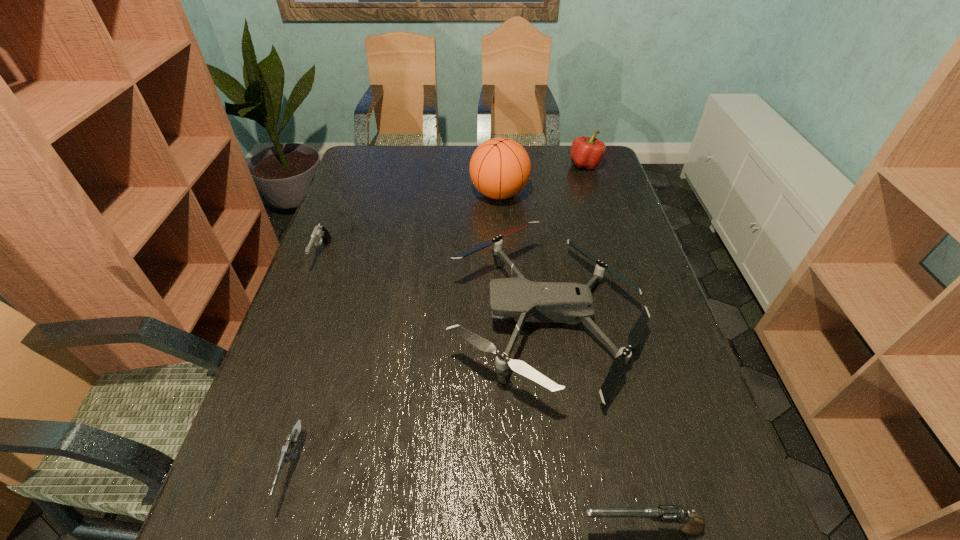
The image size is (960, 540). Identify the location of object that can be found as the fifth closest to the farthest object. (289, 452).

I want to click on object that is the fifth closest one to the bell pepper, so click(289, 452).

This screenshot has width=960, height=540. Identify the location of gun that stands as the second closest to the rightmost gun. (320, 233).

Locate which gun is the second closest to the farthest object. Please provide its 2D coordinates. Your answer should be formatted as a tuple, i.e. [(x, y)], where the tuple contains the x and y coordinates of a point satisfying the conditions above.

[(691, 524)]

What are the coordinates of `vacant region that satisfies the following two spatial constraints: 1. on the front side of the bell pepper; 2. aiming along the barrel of the nearest object` in the screenshot? It's located at (701, 529).